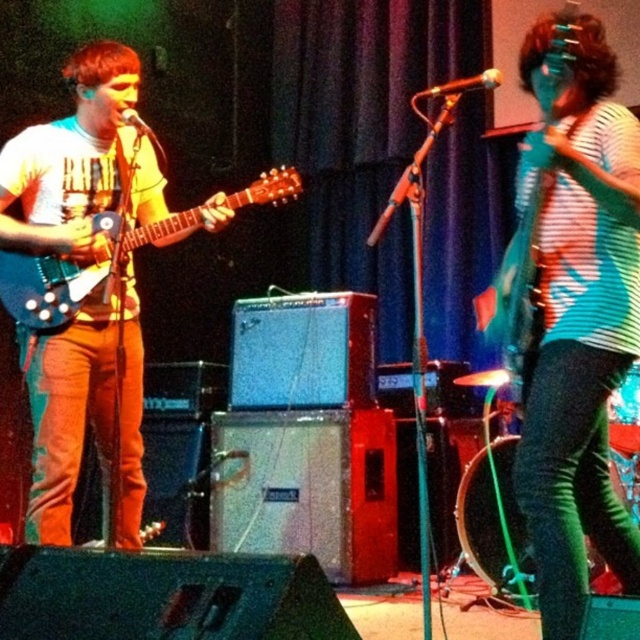
Question: Which point is closer to the camera?

Choices:
 (A) (124, 109)
 (B) (452, 88)

Answer: (B)

Question: Observing the image, what is the correct spatial positioning of matte black guitar at left in reference to metallic silver microphone at upper center?

Choices:
 (A) below
 (B) above

Answer: (A)

Question: Is matte black guitar at left above metallic silver microphone at center?

Choices:
 (A) yes
 (B) no

Answer: (B)

Question: Is metallic silver microphone at center in front of metallic silver microphone at upper center?

Choices:
 (A) yes
 (B) no

Answer: (B)

Question: Which of the following is the farthest from the observer?

Choices:
 (A) striped fabric shirt at center
 (B) metallic silver microphone at upper center
 (C) matte black guitar at left

Answer: (B)

Question: Which of the following is the closest to the observer?

Choices:
 (A) matte electric guitar at left
 (B) striped fabric shirt at center
 (C) matte black guitar at left

Answer: (B)